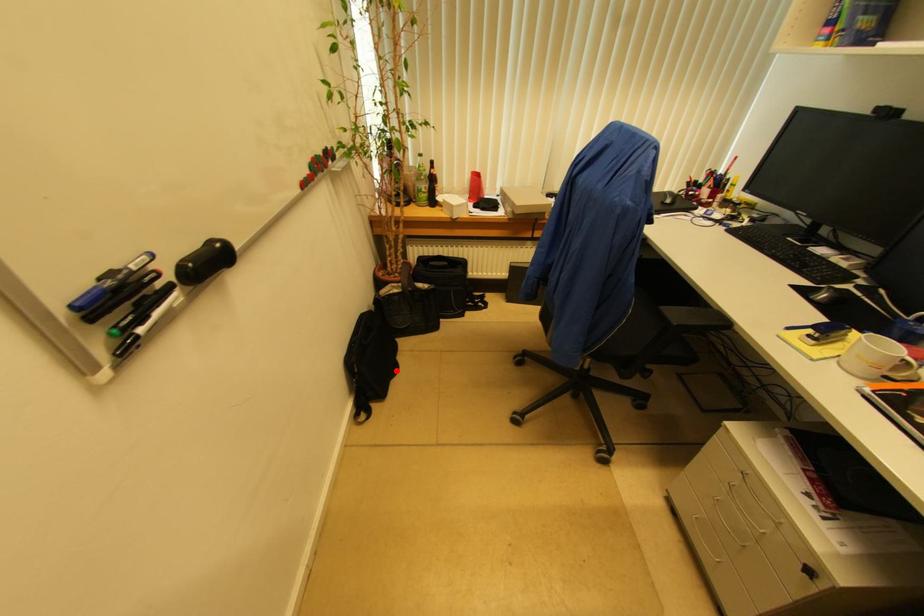
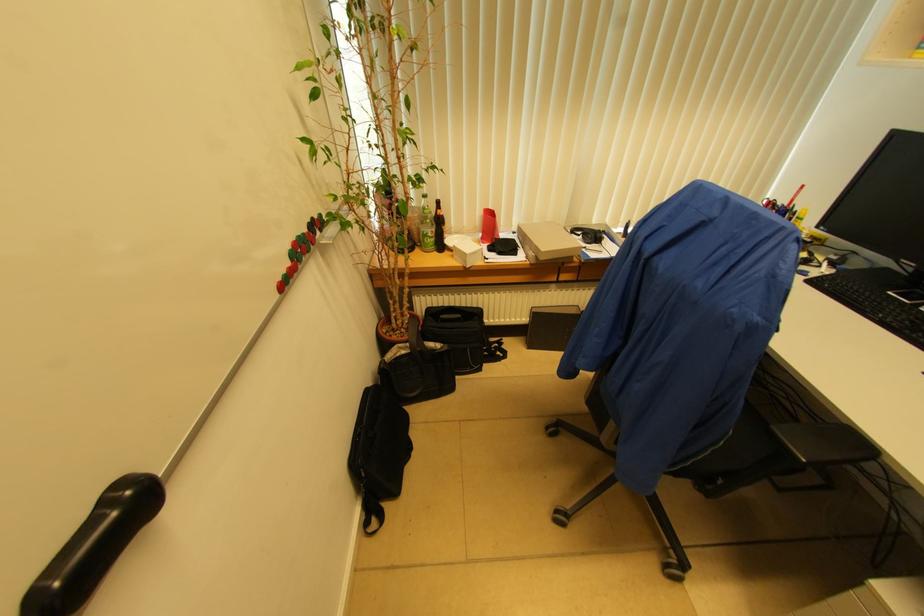
Question: I am providing you with two images of the same scene from different viewpoints. In image1, a red point is highlighted. Considering the same 3D point in image2, which of the following is correct?

Choices:
 (A) It is closer
 (B) It is farther

Answer: (B)